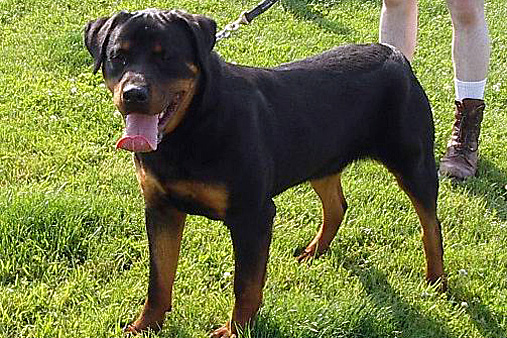
Identify the location of tan coloured chest. (214, 199).